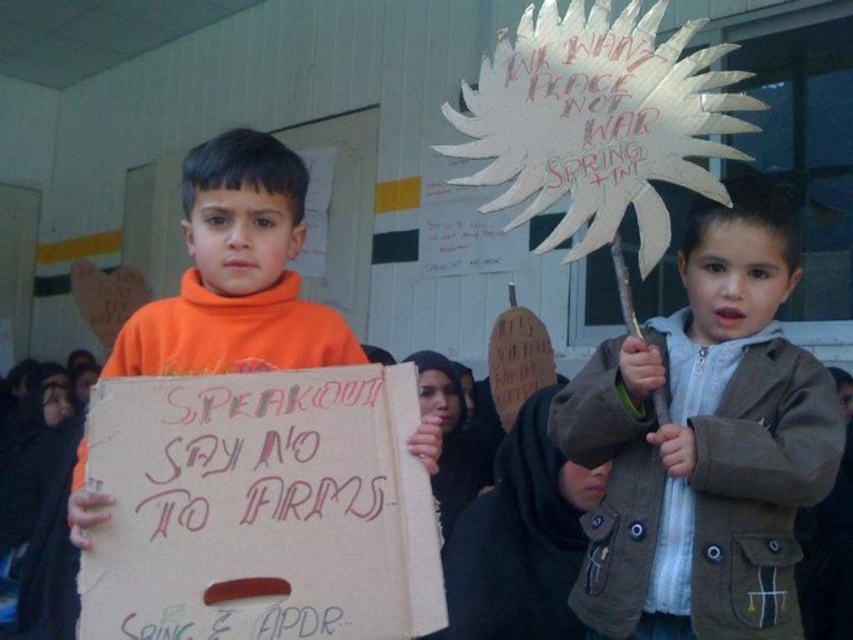
Based on the coordinates provided, what object is located at point (705, 440) in the image?

The point (705, 440) indicates the brown cotton jacket at center.

You are a photographer trying to capture a group photo of the protesters. The two central figures are wearing a brown cotton jacket at center and an orange fleece sweatshirt at center. Which of these two items of clothing takes up more visual space in the photo?

The orange fleece sweatshirt at center takes up more visual space than the brown cotton jacket at center because the brown cotton jacket at center occupies less space than orange fleece sweatshirt at center.

You are a photographer who wants to capture a clear image of both the brown cotton jacket at center and the orange fleece sweatshirt at center. Since the camera can only focus on one object at a time, which object should you choose to ensure the other remains in the background without blurring?

The brown cotton jacket at center is thinner than the orange fleece sweatshirt at center, so you should focus on the orange fleece sweatshirt at center because its greater thickness will keep the thinner brown cotton jacket at center in focus while still allowing it to be in the background.